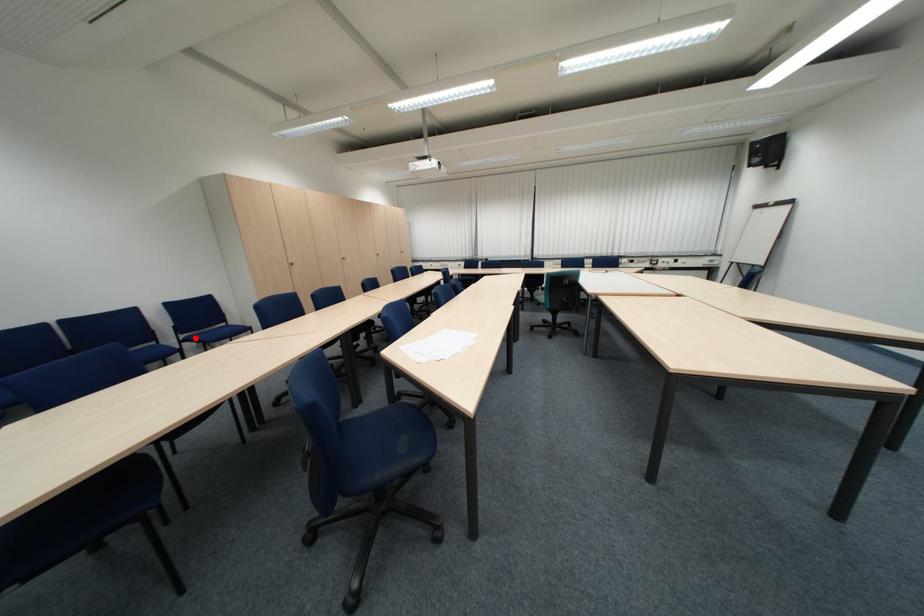
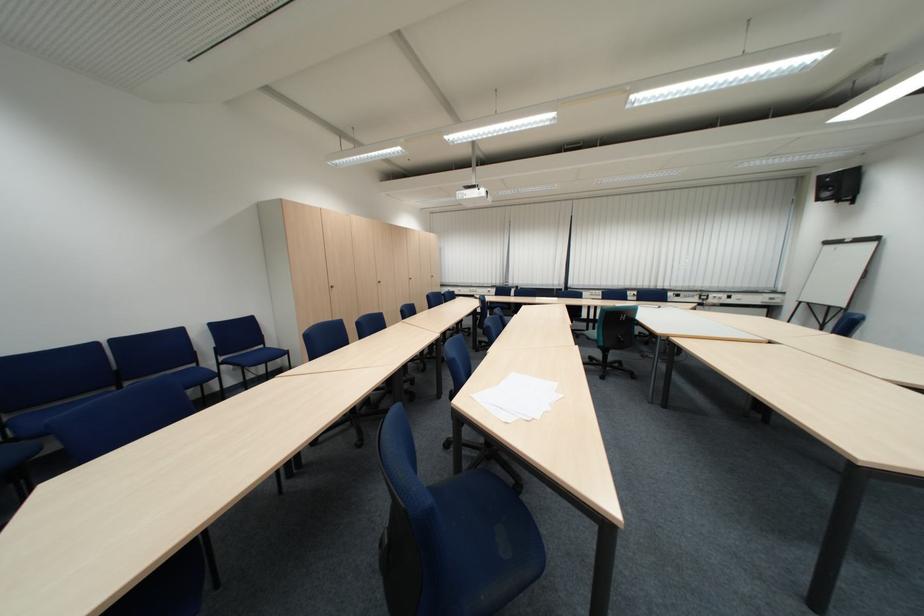
The point at the highlighted location is marked in the first image. Where is the corresponding point in the second image?

(235, 360)